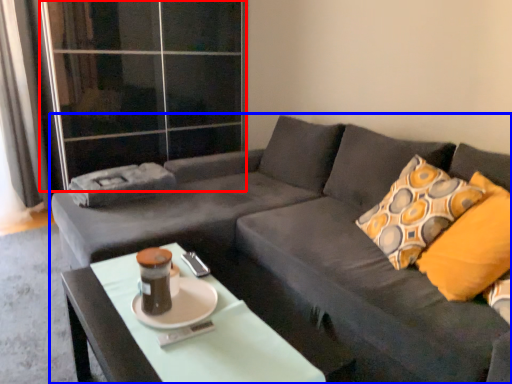
Question: Which object is closer to the camera taking this photo, glass door (highlighted by a red box) or studio couch (highlighted by a blue box)?

Choices:
 (A) glass door
 (B) studio couch

Answer: (B)